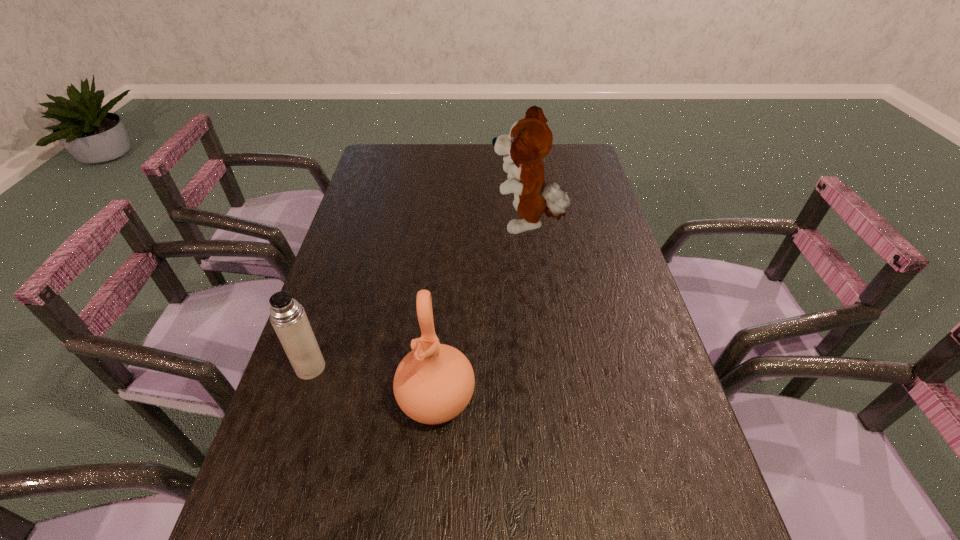
At what (x,y) coordinates should I click in order to perform the action: click on free space between the leftmost object and the pottery. Please return your answer as a coordinate pair (x, y). This screenshot has height=540, width=960. Looking at the image, I should click on (373, 384).

The image size is (960, 540). In order to click on object that is the second nearest to the leftmost object in this screenshot , I will do `click(530, 139)`.

At what (x,y) coordinates should I click in order to perform the action: click on object that is the closest to the puppy. Please return your answer as a coordinate pair (x, y). Image resolution: width=960 pixels, height=540 pixels. Looking at the image, I should click on (433, 384).

I want to click on vacant space that satisfies the following two spatial constraints: 1. on the face of the rightmost object; 2. on the spout of the pottery, so click(x=549, y=400).

Image resolution: width=960 pixels, height=540 pixels. What are the coordinates of `vacant space that satisfies the following two spatial constraints: 1. on the face of the farthest object; 2. on the spout of the second shortest object` in the screenshot? It's located at (549, 400).

Find the location of a particular element. This screenshot has width=960, height=540. free space that satisfies the following two spatial constraints: 1. on the face of the rightmost object; 2. on the spout of the pottery is located at coordinates (549, 400).